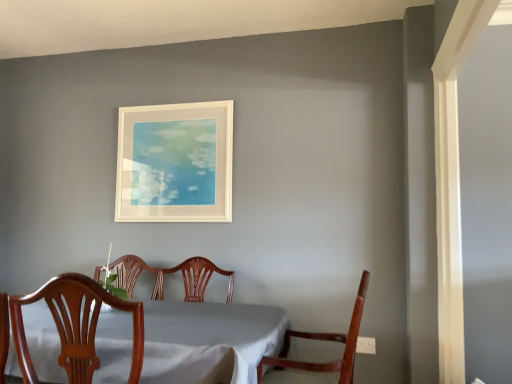
Question: From the image's perspective, relative to wooden chair at center, marked as the second chair in a right-to-left arrangement, is mahogany wood chair at lower right, which is the first chair in right-to-left order, above or below?

Choices:
 (A) below
 (B) above

Answer: (A)

Question: Is mahogany wood chair at lower right, which is the first chair in right-to-left order, taller or shorter than wooden chair at center, marked as the second chair in a right-to-left arrangement?

Choices:
 (A) short
 (B) tall

Answer: (B)

Question: Estimate the real-world distances between objects in this image. Which object is farther from the white cloth-covered table at center?

Choices:
 (A) white matte picture frame at upper center
 (B) wooden chair at center, which appears as the first chair when viewed from the left
 (C) mahogany wood chair at lower right, which is the first chair in right-to-left order

Answer: (A)

Question: Which of these objects is positioned farthest from the white matte picture frame at upper center?

Choices:
 (A) white cloth-covered table at center
 (B) wooden chair at center, marked as the second chair in a right-to-left arrangement
 (C) mahogany wood chair at lower right, which is the first chair in right-to-left order

Answer: (B)